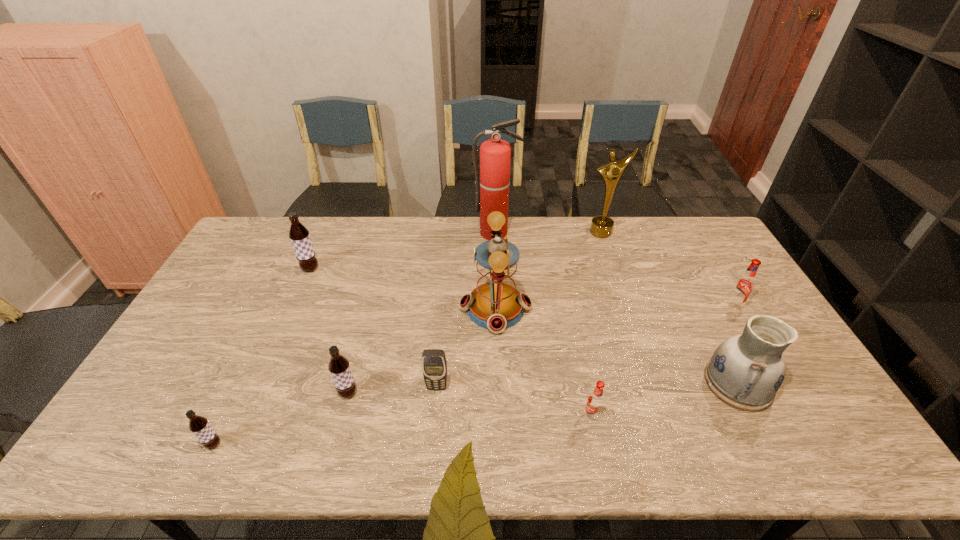
What are the coordinates of `free spot between the eighth object from left to right and the second farthest root beer` in the screenshot? It's located at (667, 269).

Image resolution: width=960 pixels, height=540 pixels. Find the location of `free space between the tallest object and the pottery`. free space between the tallest object and the pottery is located at coordinates (616, 308).

The height and width of the screenshot is (540, 960). Identify the location of free area in between the farther red root beer and the third root beer from left to right. (540, 349).

Locate an element on the screen. The height and width of the screenshot is (540, 960). vacant area that lies between the fourth root beer from left to right and the rightmost brown root beer is located at coordinates (469, 404).

You are a GUI agent. You are given a task and a screenshot of the screen. Output one action in this format:
    pyautogui.click(x=<x>, y=<y>)
    Task: Click on the empty space between the fourth object from right to left and the eighth object from right to left
    
    Given the screenshot: What is the action you would take?
    pyautogui.click(x=469, y=404)

Identify the location of free space between the cellular telephone and the lantern. (467, 348).

Locate an element on the screen. vacant point located between the nearest root beer and the seventh object from right to left is located at coordinates click(325, 415).

Where is `free space between the seventh object from left to right and the bigger red root beer`? free space between the seventh object from left to right and the bigger red root beer is located at coordinates (662, 360).

Point out which object is positioned as the seventh nearest to the pottery. Please provide its 2D coordinates. Your answer should be formatted as a tuple, i.e. [(x, y)], where the tuple contains the x and y coordinates of a point satisfying the conditions above.

[(339, 367)]

What are the coordinates of `the seventh closest object to the smaller red root beer` in the screenshot? It's located at (601, 226).